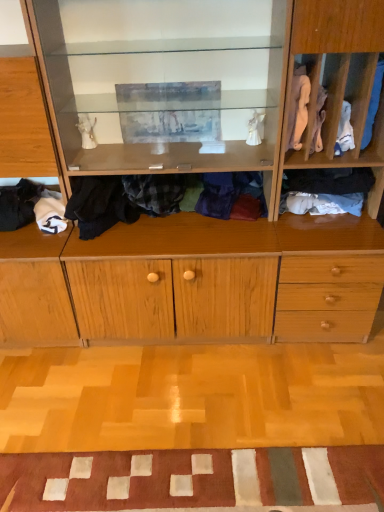
Question: Is white cotton socks at right, which is the fifth clothing in left-to-right order, completely or partially outside of wooden cabinet at center, which is the second cabinetry in left-to-right order?

Choices:
 (A) yes
 (B) no

Answer: (A)

Question: Considering the relative sizes of white cotton socks at right, which is the fifth clothing in left-to-right order, and wooden cabinet at center, which is the 1th cabinetry in right-to-left order, in the image provided, is white cotton socks at right, which is the fifth clothing in left-to-right order, wider than wooden cabinet at center, which is the 1th cabinetry in right-to-left order,?

Choices:
 (A) no
 (B) yes

Answer: (A)

Question: Is white cotton socks at right, which appears as the 2th clothing when viewed from the right, to the left of wooden cabinet at center, which is the second cabinetry in left-to-right order, from the viewer's perspective?

Choices:
 (A) yes
 (B) no

Answer: (B)

Question: Is the depth of white cotton socks at right, which is the fifth clothing in left-to-right order, greater than that of wooden cabinet at center, which is the second cabinetry in left-to-right order?

Choices:
 (A) yes
 (B) no

Answer: (A)

Question: Would you say white cotton socks at right, which appears as the 2th clothing when viewed from the right, contains wooden cabinet at center, which is the second cabinetry in left-to-right order?

Choices:
 (A) no
 (B) yes

Answer: (A)

Question: From the image's perspective, is white cotton socks at right, which is the fifth clothing in left-to-right order, located above or below wooden cabinet at center, which is the second cabinetry in left-to-right order?

Choices:
 (A) below
 (B) above

Answer: (A)

Question: Is white cotton socks at right, which is the fifth clothing in left-to-right order, inside or outside of wooden cabinet at center, which is the 1th cabinetry in right-to-left order?

Choices:
 (A) inside
 (B) outside

Answer: (B)

Question: Looking at the image, does white cotton socks at right, which appears as the 2th clothing when viewed from the right, seem bigger or smaller compared to wooden cabinet at center, which is the second cabinetry in left-to-right order?

Choices:
 (A) small
 (B) big

Answer: (A)

Question: Is white cotton socks at right, which appears as the 2th clothing when viewed from the right, in front of or behind wooden cabinet at center, which is the 1th cabinetry in right-to-left order, in the image?

Choices:
 (A) front
 (B) behind

Answer: (B)

Question: From a real-world perspective, is blue cotton socks at right, the 6th clothing viewed from the left, physically located above or below patchwork fabric doormat at lower center?

Choices:
 (A) below
 (B) above

Answer: (B)

Question: Looking at their shapes, would you say blue cotton socks at right, the 6th clothing viewed from the left, is wider or thinner than patchwork fabric doormat at lower center?

Choices:
 (A) wide
 (B) thin

Answer: (B)

Question: Is blue cotton socks at right, the 6th clothing viewed from the left, inside or outside of patchwork fabric doormat at lower center?

Choices:
 (A) inside
 (B) outside

Answer: (B)

Question: Considering the positions of point (374, 78) and point (160, 500), is point (374, 78) closer or farther from the camera than point (160, 500)?

Choices:
 (A) closer
 (B) farther

Answer: (B)

Question: From their relative heights in the image, would you say wooden cabinet at center, which is the 1th cabinetry in right-to-left order, is taller or shorter than soft white fabric at lower left, which appears as the 1th clothing when viewed from the left?

Choices:
 (A) short
 (B) tall

Answer: (B)

Question: In the image, is wooden cabinet at center, which is the 1th cabinetry in right-to-left order, on the left side or the right side of soft white fabric at lower left, which appears as the 1th clothing when viewed from the left?

Choices:
 (A) right
 (B) left

Answer: (A)